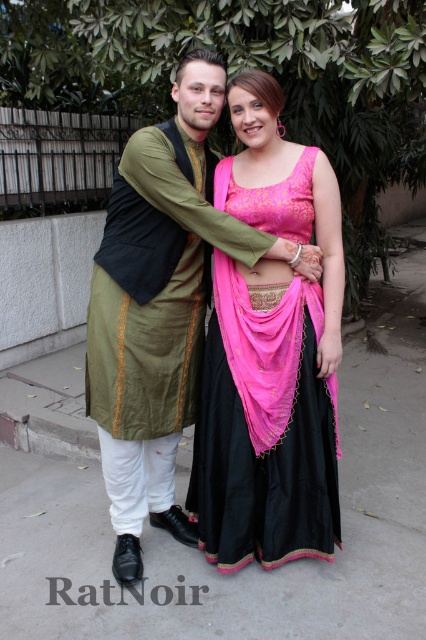
Question: Considering the relative positions of gray concrete pavement at center and pink satin lehenga at center in the image provided, where is gray concrete pavement at center located with respect to pink satin lehenga at center?

Choices:
 (A) right
 (B) left

Answer: (B)

Question: Which point is farther to the camera?

Choices:
 (A) (296, 298)
 (B) (383, 376)

Answer: (B)

Question: Is gray concrete pavement at center above pink satin lehenga at center?

Choices:
 (A) yes
 (B) no

Answer: (B)

Question: Which point is closer to the camera?

Choices:
 (A) gray concrete pavement at center
 (B) pink satin lehenga at center

Answer: (A)

Question: Is gray concrete pavement at center above pink satin lehenga at center?

Choices:
 (A) no
 (B) yes

Answer: (A)